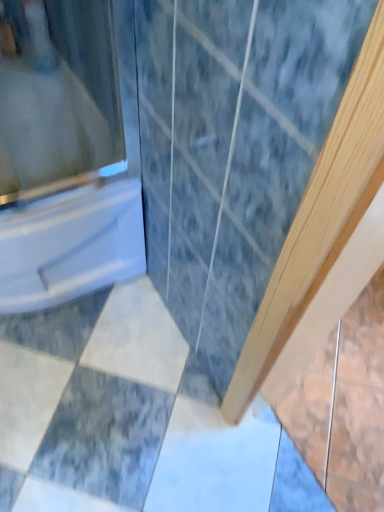
What do you see at coordinates (69, 156) in the screenshot?
I see `glossy white bathtub at left` at bounding box center [69, 156].

I want to click on glossy white bathtub at left, so click(x=69, y=156).

Find the location of a particular element. The height and width of the screenshot is (512, 384). glossy white bathtub at left is located at coordinates (69, 156).